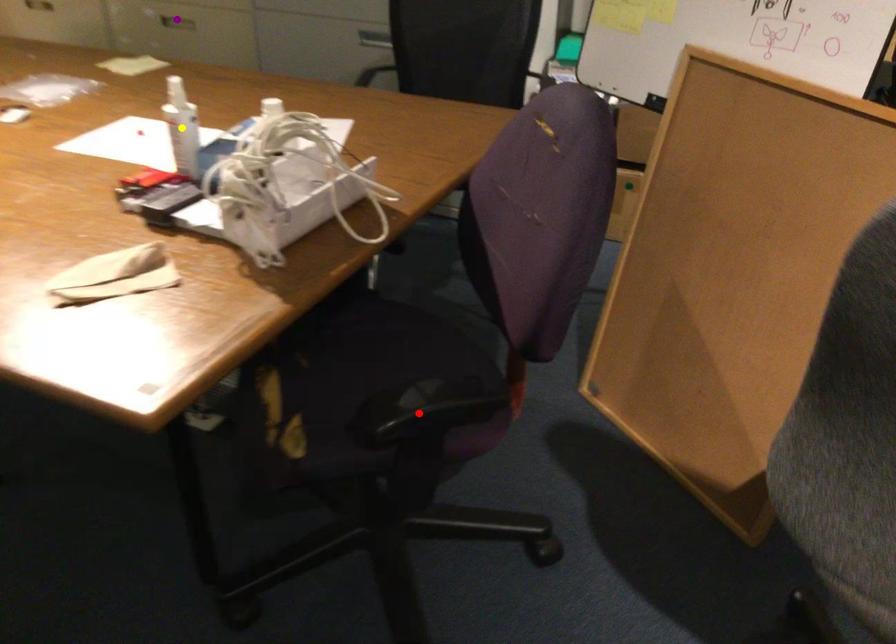
Order these from nearest to farthest:
purple point | red point | yellow point

red point < yellow point < purple point